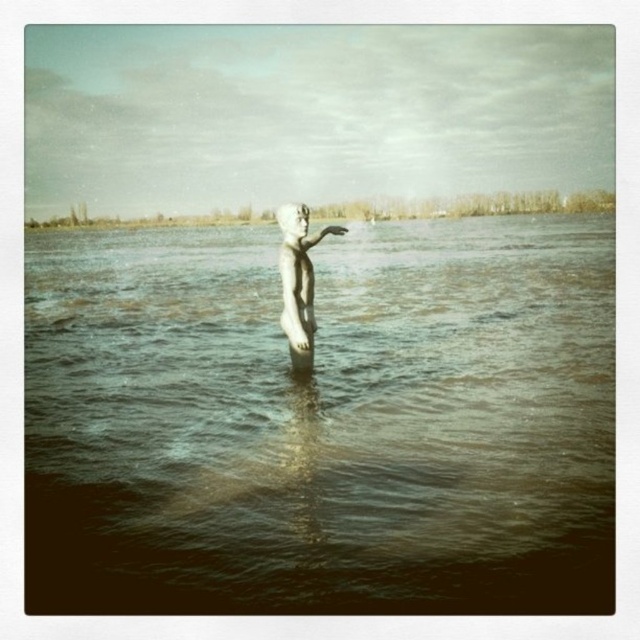
Can you confirm if metallic water at center is positioned above white stone statue at center?

Yes.

Is metallic water at center to the left of white stone statue at center from the viewer's perspective?

No, metallic water at center is not to the left of white stone statue at center.

Is point (584, 515) farther from camera compared to point (300, 252)?

That is False.

The height and width of the screenshot is (640, 640). I want to click on metallic water at center, so click(323, 419).